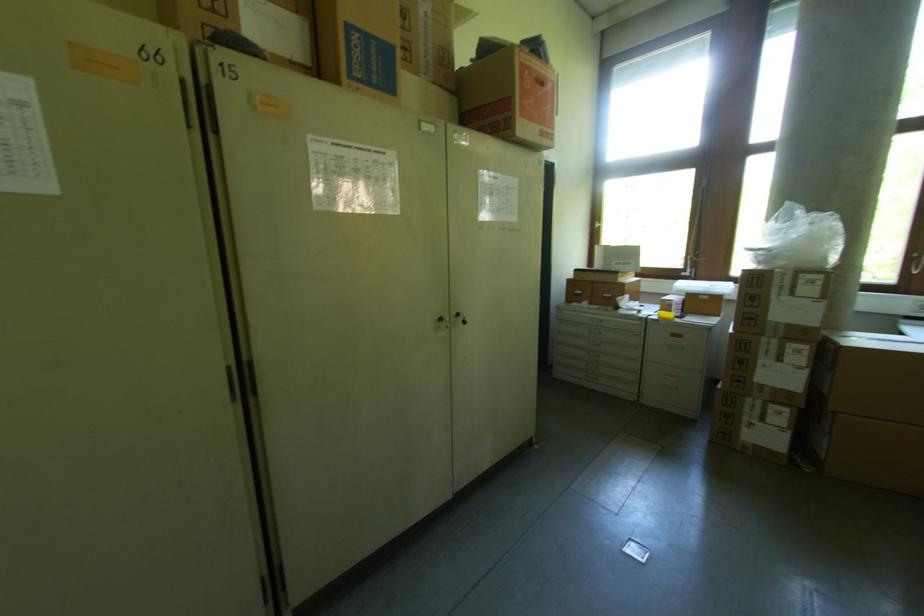
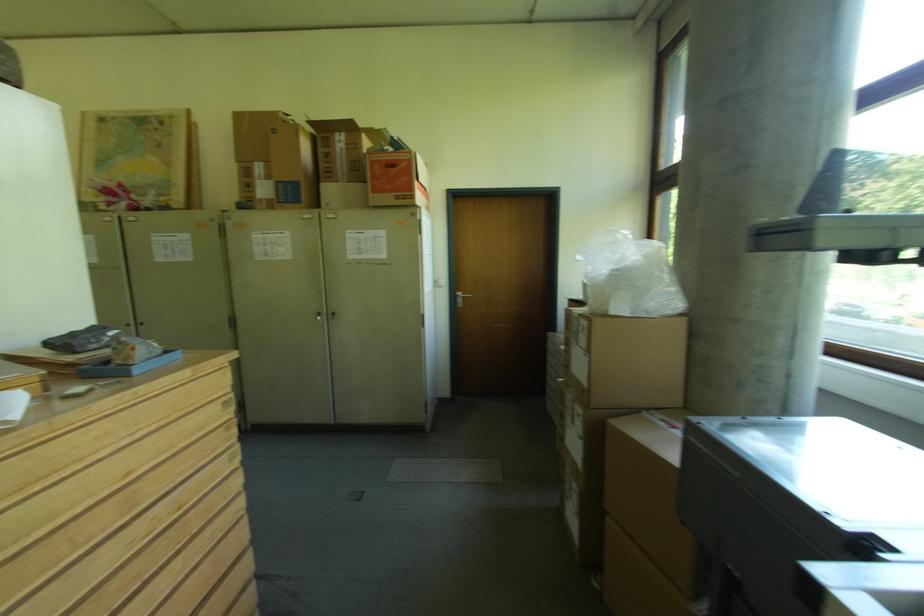
Find the pixel in the second image that matches pixel 543 136 in the first image.

(399, 200)